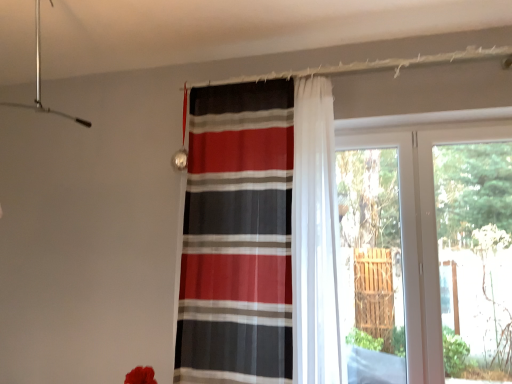
Question: Does striped fabric curtain at center turn towards transparent glass door at right?

Choices:
 (A) no
 (B) yes

Answer: (A)

Question: Is striped fabric curtain at center closer to camera compared to transparent glass door at right?

Choices:
 (A) no
 (B) yes

Answer: (B)

Question: Is striped fabric curtain at center in contact with transparent glass door at right?

Choices:
 (A) no
 (B) yes

Answer: (A)

Question: Is striped fabric curtain at center outside of transparent glass door at right?

Choices:
 (A) yes
 (B) no

Answer: (A)

Question: Is striped fabric curtain at center to the right of transparent glass door at right from the viewer's perspective?

Choices:
 (A) yes
 (B) no

Answer: (B)

Question: Considering their positions, is striped fabric curtain at center located in front of or behind transparent glass door at right?

Choices:
 (A) behind
 (B) front

Answer: (B)

Question: Is striped fabric curtain at center inside the boundaries of transparent glass door at right, or outside?

Choices:
 (A) inside
 (B) outside

Answer: (B)

Question: From a real-world perspective, is striped fabric curtain at center positioned above or below transparent glass door at right?

Choices:
 (A) above
 (B) below

Answer: (A)

Question: Considering the positions of striped fabric curtain at center and transparent glass door at right in the image, is striped fabric curtain at center wider or thinner than transparent glass door at right?

Choices:
 (A) thin
 (B) wide

Answer: (B)

Question: Does point (371, 243) appear closer or farther from the camera than point (203, 193)?

Choices:
 (A) closer
 (B) farther

Answer: (B)

Question: Choose the correct answer: Is transparent glass screen door at right inside striped fabric curtain at center or outside it?

Choices:
 (A) outside
 (B) inside

Answer: (A)

Question: Considering the relative positions of transparent glass screen door at right and striped fabric curtain at center in the image provided, is transparent glass screen door at right to the left or to the right of striped fabric curtain at center?

Choices:
 (A) right
 (B) left

Answer: (A)

Question: Considering the positions of transparent glass screen door at right and striped fabric curtain at center in the image, is transparent glass screen door at right wider or thinner than striped fabric curtain at center?

Choices:
 (A) thin
 (B) wide

Answer: (A)

Question: Is transparent glass door at right bigger or smaller than transparent glass screen door at right?

Choices:
 (A) big
 (B) small

Answer: (A)

Question: Considering their positions, is transparent glass door at right located in front of or behind transparent glass screen door at right?

Choices:
 (A) front
 (B) behind

Answer: (A)